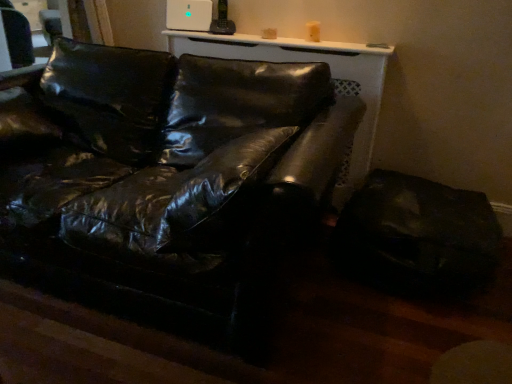
Question: Is shiny black leather swivel chair at lower right in front of or behind glossy black leather couch at center in the image?

Choices:
 (A) front
 (B) behind

Answer: (B)

Question: Is shiny black leather swivel chair at lower right bigger or smaller than glossy black leather couch at center?

Choices:
 (A) small
 (B) big

Answer: (A)

Question: Does point (x=396, y=231) appear closer or farther from the camera than point (x=214, y=210)?

Choices:
 (A) farther
 (B) closer

Answer: (A)

Question: From a real-world perspective, relative to shiny black leather swivel chair at lower right, is glossy black leather couch at center vertically above or below?

Choices:
 (A) above
 (B) below

Answer: (A)

Question: Considering their positions, is glossy black leather couch at center located in front of or behind shiny black leather swivel chair at lower right?

Choices:
 (A) front
 (B) behind

Answer: (A)

Question: Do you think glossy black leather couch at center is within shiny black leather swivel chair at lower right, or outside of it?

Choices:
 (A) inside
 (B) outside

Answer: (B)

Question: From the image's perspective, is glossy black leather couch at center positioned above or below shiny black leather swivel chair at lower right?

Choices:
 (A) below
 (B) above

Answer: (B)